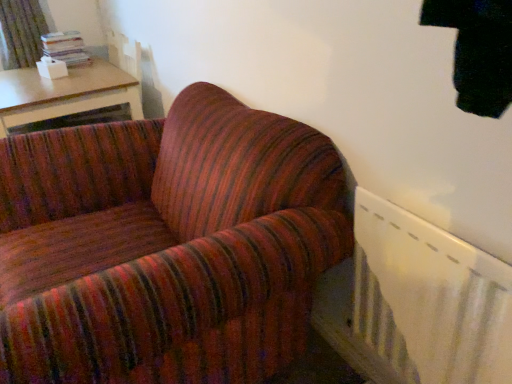
This screenshot has height=384, width=512. What do you see at coordinates (21, 32) in the screenshot?
I see `green textured curtain at upper left` at bounding box center [21, 32].

Locate an element on the screen. wooden table at upper left is located at coordinates click(64, 93).

Are white plastic radiator at lower right and green textured curtain at upper left located far from each other?

white plastic radiator at lower right is far away from green textured curtain at upper left.

Considering the sizes of objects white plastic radiator at lower right and green textured curtain at upper left in the image provided, who is thinner, white plastic radiator at lower right or green textured curtain at upper left?

white plastic radiator at lower right is thinner.

What's the angular difference between white plastic radiator at lower right and green textured curtain at upper left's facing directions?

87.4 degrees separate the facing orientations of white plastic radiator at lower right and green textured curtain at upper left.

Can we say white plastic radiator at lower right lies outside green textured curtain at upper left?

Yes, white plastic radiator at lower right is located beyond the bounds of green textured curtain at upper left.

Who is taller, wooden table at upper left or green textured curtain at upper left?

wooden table at upper left is taller.

Based on the photo, is wooden table at upper left behind green textured curtain at upper left?

No.

Is wooden table at upper left completely or partially outside of green textured curtain at upper left?

Absolutely, wooden table at upper left is external to green textured curtain at upper left.

Locate an element on the screen. curtain lying on the left of wooden table at upper left is located at coordinates 21,32.

Considering the points (36, 1) and (104, 73), which point is behind, point (36, 1) or point (104, 73)?

Positioned behind is point (36, 1).

At what (x,y) coordinates should I click in order to perform the action: click on table below the green textured curtain at upper left (from the image's perspective). Please return your answer as a coordinate pair (x, y). The width and height of the screenshot is (512, 384). Looking at the image, I should click on (64, 93).

Is green textured curtain at upper left oriented away from wooden table at upper left?

No, green textured curtain at upper left is not facing the opposite direction of wooden table at upper left.

In the scene shown: Between green textured curtain at upper left and wooden table at upper left, which one appears on the left side from the viewer's perspective?

Positioned to the left is green textured curtain at upper left.

Is point (33, 10) positioned behind point (407, 337)?

Yes, point (33, 10) is farther from viewer.

Which object is positioned more to the right, green textured curtain at upper left or white plastic radiator at lower right?

white plastic radiator at lower right.

Is green textured curtain at upper left oriented away from white plastic radiator at lower right?

green textured curtain at upper left does not have its back to white plastic radiator at lower right.

Which is correct: green textured curtain at upper left is inside white plastic radiator at lower right, or outside of it?

green textured curtain at upper left cannot be found inside white plastic radiator at lower right.

Is white plastic radiator at lower right touching wooden table at upper left?

white plastic radiator at lower right and wooden table at upper left are not in contact.

Between white plastic radiator at lower right and wooden table at upper left, which one appears on the right side from the viewer's perspective?

white plastic radiator at lower right is more to the right.

Which of these two, white plastic radiator at lower right or wooden table at upper left, stands taller?

white plastic radiator at lower right.

Does white plastic radiator at lower right lie behind wooden table at upper left?

No, it is not.

Can you tell me how much wooden table at upper left and white plastic radiator at lower right differ in facing direction?

The facing directions of wooden table at upper left and white plastic radiator at lower right are 2.45 degrees apart.

Is wooden table at upper left not close to white plastic radiator at lower right?

That's right, there is a large distance between wooden table at upper left and white plastic radiator at lower right.

Considering the points (60, 84) and (480, 326), which point is behind, point (60, 84) or point (480, 326)?

The point (60, 84) is farther.

Locate an element on the screen. The image size is (512, 384). radiator below the green textured curtain at upper left (from a real-world perspective) is located at coordinates [429, 299].

This screenshot has height=384, width=512. Find the location of `table lying on the right of green textured curtain at upper left`. table lying on the right of green textured curtain at upper left is located at coordinates tap(64, 93).

When comparing their distances from green textured curtain at upper left, does white plastic radiator at lower right or wooden table at upper left seem closer?

wooden table at upper left lies closer to green textured curtain at upper left than the other object.

Looking at the image, which one is located further to wooden table at upper left, white plastic radiator at lower right or green textured curtain at upper left?

Among the two, white plastic radiator at lower right is located further to wooden table at upper left.

Estimate the real-world distances between objects in this image. Which object is closer to white plastic radiator at lower right, green textured curtain at upper left or wooden table at upper left?

Among the two, wooden table at upper left is located nearer to white plastic radiator at lower right.

Considering their positions, is green textured curtain at upper left positioned closer to wooden table at upper left than white plastic radiator at lower right?

green textured curtain at upper left is positioned closer to the anchor wooden table at upper left.

Which object lies nearer to the anchor point white plastic radiator at lower right, wooden table at upper left or green textured curtain at upper left?

wooden table at upper left is positioned closer to the anchor white plastic radiator at lower right.

Estimate the real-world distances between objects in this image. Which object is further from green textured curtain at upper left, wooden table at upper left or white plastic radiator at lower right?

The object further to green textured curtain at upper left is white plastic radiator at lower right.

The height and width of the screenshot is (384, 512). What are the coordinates of `table located between white plastic radiator at lower right and green textured curtain at upper left in the depth direction` in the screenshot? It's located at (64, 93).